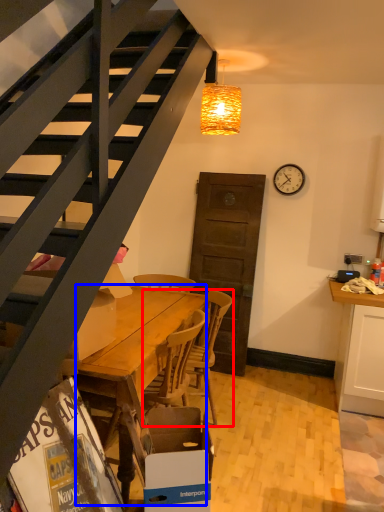
Question: Among these objects, which one is nearest to the camera, chair (highlighted by a red box) or desk (highlighted by a blue box)?

Choices:
 (A) chair
 (B) desk

Answer: (B)